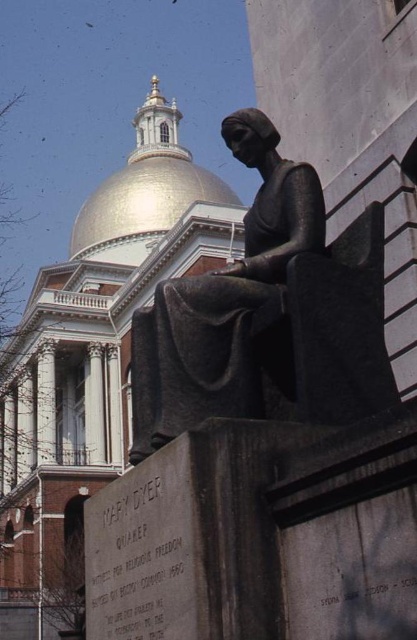
Question: Among these points, which one is nearest to the camera?

Choices:
 (A) (158, 184)
 (B) (143, 326)

Answer: (B)

Question: Is bronze statue at center positioned before gold polished dome at upper center?

Choices:
 (A) yes
 (B) no

Answer: (A)

Question: Is bronze statue at center to the right of gold polished dome at upper center from the viewer's perspective?

Choices:
 (A) no
 (B) yes

Answer: (B)

Question: Which of the following is the farthest from the observer?

Choices:
 (A) gold polished dome at upper center
 (B) bronze statue at center

Answer: (A)

Question: Does bronze statue at center come behind gold polished dome at upper center?

Choices:
 (A) yes
 (B) no

Answer: (B)